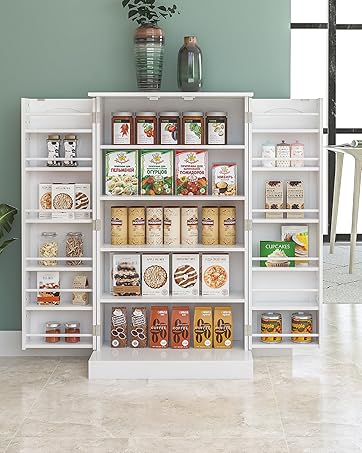
This screenshot has width=362, height=453. I want to click on food containers in right side open door, so click(x=269, y=151), click(x=284, y=150), click(x=295, y=151), click(x=295, y=191), click(x=274, y=194), click(x=300, y=232), click(x=285, y=246), click(x=298, y=329), click(x=265, y=327).